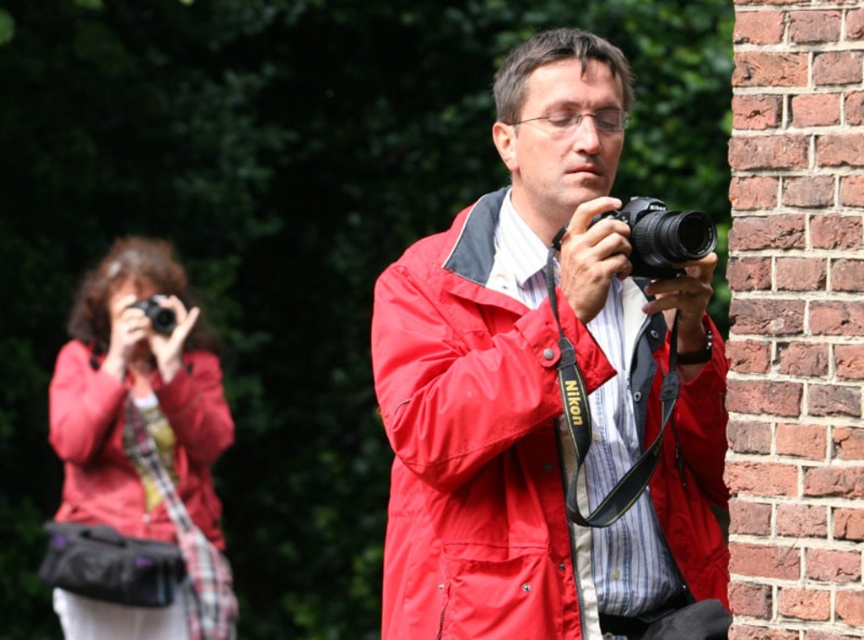
Question: Estimate the real-world distances between objects in this image. Which object is closer to the black plastic camera at center?

Choices:
 (A) matte nylon jacket at center
 (B) matte black camera at center
 (C) black plastic camera at upper left

Answer: (A)

Question: Among these points, which one is nearest to the camera?

Choices:
 (A) (170, 316)
 (B) (471, 394)
 (C) (197, 480)

Answer: (B)

Question: Can you confirm if matte black camera at center is positioned above black plastic camera at center?

Choices:
 (A) no
 (B) yes

Answer: (A)

Question: Is matte nylon jacket at center in front of black plastic camera at upper left?

Choices:
 (A) yes
 (B) no

Answer: (A)

Question: From the image, what is the correct spatial relationship of matte nylon jacket at center in relation to matte black camera at center?

Choices:
 (A) above
 (B) below

Answer: (A)

Question: Considering the real-world distances, which object is farthest from the black plastic camera at upper left?

Choices:
 (A) matte nylon jacket at center
 (B) matte black camera at center

Answer: (A)